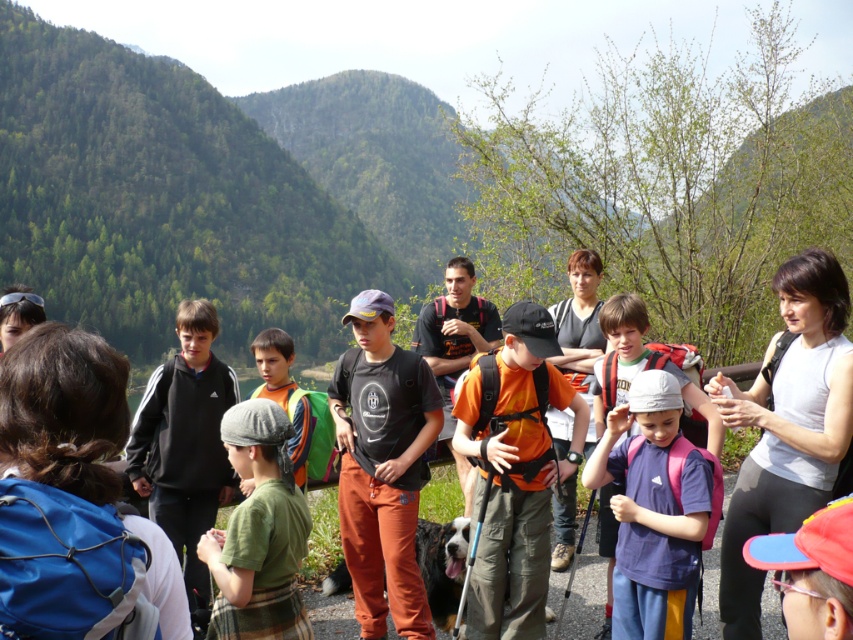
You are organizing a group photo for the people in the mountain setting. You need to arrange them so that the purple matte shirt at center and the green cotton shirt at center are visible. Given their sizes, which shirt should be placed in front to ensure both are visible?

The green cotton shirt at center should be placed in front because it is smaller in size compared to the purple matte shirt at center, allowing both to be visible in the group photo.

You are a hiker trying to take a photo of the orange fabric backpack at center and the green forested mountain at center. Which object should you focus on first if you want to capture both in the same frame without moving the camera?

The green forested mountain at center is positioned on the left side of the orange fabric backpack at center, so you should focus on the green forested mountain at center first to ensure both are in the frame.

Where is the purple matte shirt at center located in the image?

The purple matte shirt at center is located at point coordinates of (653, 513).